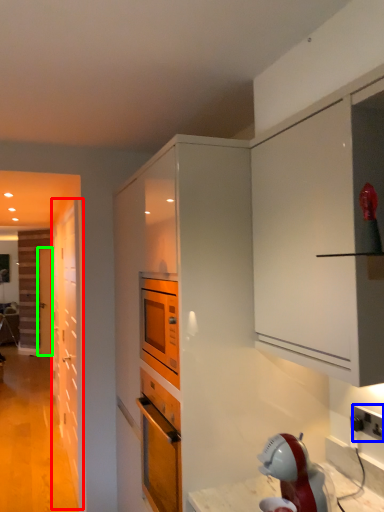
Question: Which object is positioned farthest from door (highlighted by a red box)? Select from electric outlet (highlighted by a blue box) and door (highlighted by a green box).

Choices:
 (A) electric outlet
 (B) door

Answer: (A)